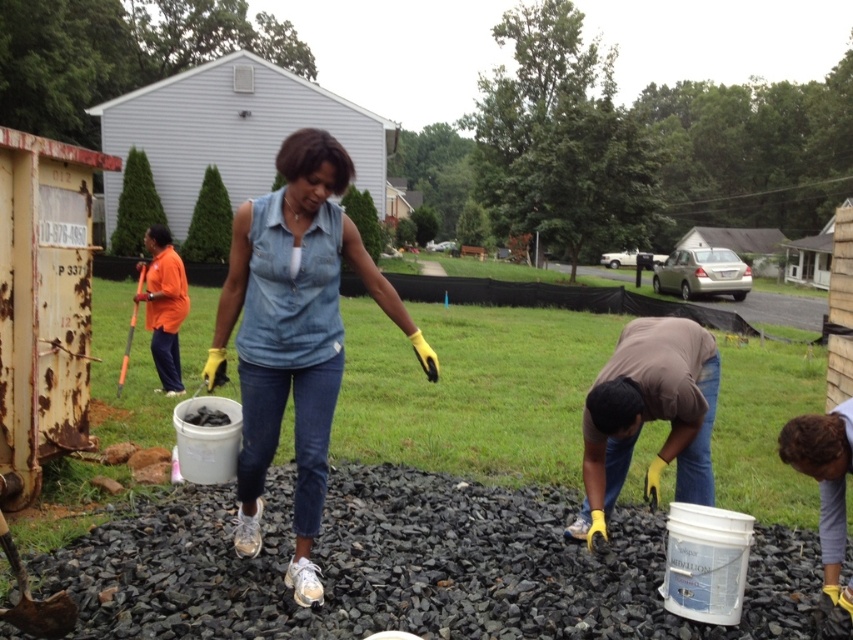
Question: Does curly hair at lower right have a larger size compared to orange fabric shirt at left?

Choices:
 (A) no
 (B) yes

Answer: (A)

Question: Can you confirm if black gravel at center is smaller than curly hair at lower right?

Choices:
 (A) yes
 (B) no

Answer: (B)

Question: Is black gravel at center positioned in front of orange fabric shirt at left?

Choices:
 (A) no
 (B) yes

Answer: (B)

Question: Which point appears closest to the camera in this image?

Choices:
 (A) (833, 508)
 (B) (218, 355)

Answer: (A)

Question: Which of these objects is positioned closest to the black gravel at center?

Choices:
 (A) curly hair at lower right
 (B) denim shirt at center

Answer: (B)

Question: Which point is farther to the camera?

Choices:
 (A) black gravel at center
 (B) denim shirt at center
 (C) orange fabric shirt at left

Answer: (C)